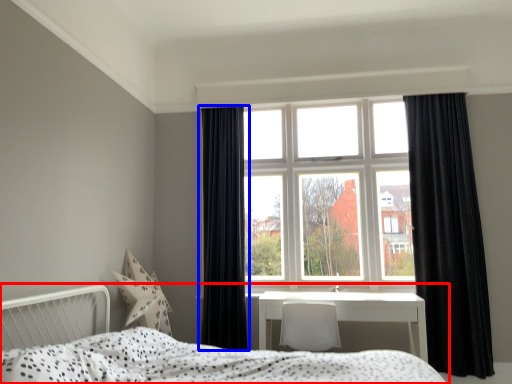
Question: Among these objects, which one is farthest to the camera, bed (highlighted by a red box) or curtain (highlighted by a blue box)?

Choices:
 (A) bed
 (B) curtain

Answer: (B)